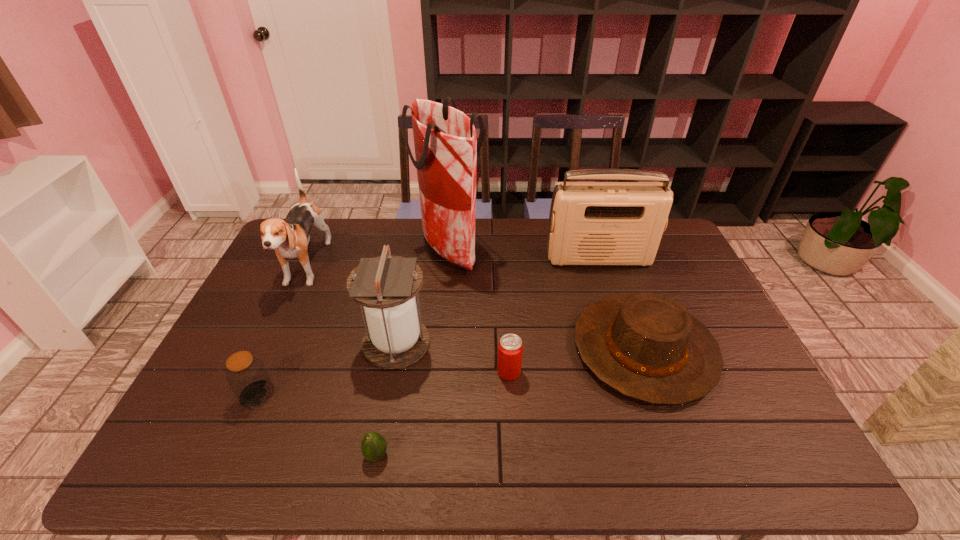
Locate an element on the screen. vacant region at the near right corner of the desktop is located at coordinates pos(742,444).

Image resolution: width=960 pixels, height=540 pixels. Identify the location of vacant area that lies between the avocado and the jar. (317, 424).

Where is `empty space that is in between the avocado and the can`? This screenshot has width=960, height=540. empty space that is in between the avocado and the can is located at coordinates (443, 414).

Where is `free space between the avocado and the radio receiver`? The height and width of the screenshot is (540, 960). free space between the avocado and the radio receiver is located at coordinates (488, 357).

Where is `vacant area that lies between the puppy and the radio receiver`? The width and height of the screenshot is (960, 540). vacant area that lies between the puppy and the radio receiver is located at coordinates (452, 264).

Where is `free space between the grocery bag and the cowboy hat`? The image size is (960, 540). free space between the grocery bag and the cowboy hat is located at coordinates (546, 299).

The width and height of the screenshot is (960, 540). In order to click on free space between the nearest object and the cowboy hat in this screenshot , I will do `click(511, 402)`.

Image resolution: width=960 pixels, height=540 pixels. What are the coordinates of `free spot between the puppy and the lantern` in the screenshot? It's located at 351,306.

Image resolution: width=960 pixels, height=540 pixels. Identify the location of vacant space that is in between the grocery bag and the lantern. (422, 296).

Identify the location of vacant space that is in between the grocery bag and the radio receiver. The width and height of the screenshot is (960, 540). (524, 254).